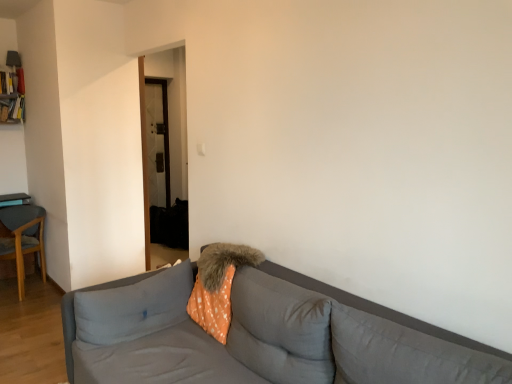
Question: From their relative heights in the image, would you say fuzzy orange pillow at center, placed as the 3th pillow when sorted from right to left, is taller or shorter than orange polka dot pillow at center, the fourth pillow in the right-to-left sequence?

Choices:
 (A) tall
 (B) short

Answer: (B)

Question: Considering their positions, is fuzzy orange pillow at center, placed as the 3th pillow when sorted from right to left, located in front of or behind orange polka dot pillow at center, the first pillow when ordered from left to right?

Choices:
 (A) behind
 (B) front

Answer: (A)

Question: Estimate the real-world distances between objects in this image. Which object is farther from the wooden chair at left?

Choices:
 (A) gray fabric couch at center
 (B) gray fabric pillow at lower right, marked as the fourth pillow in a left-to-right arrangement
 (C) orange polka dot fabric at center
 (D) orange polka dot pillow at center, which is the 3th pillow from left to right
 (E) orange polka dot pillow at center, the fourth pillow in the right-to-left sequence

Answer: (B)

Question: Estimate the real-world distances between objects in this image. Which object is farther from the orange polka dot pillow at center, which ranks as the 2th pillow in right-to-left order?

Choices:
 (A) orange polka dot pillow at center, the first pillow when ordered from left to right
 (B) fuzzy orange pillow at center, placed as the 3th pillow when sorted from right to left
 (C) gray fabric pillow at lower right, marked as the fourth pillow in a left-to-right arrangement
 (D) wooden chair at left
 (E) gray fabric couch at center

Answer: (D)